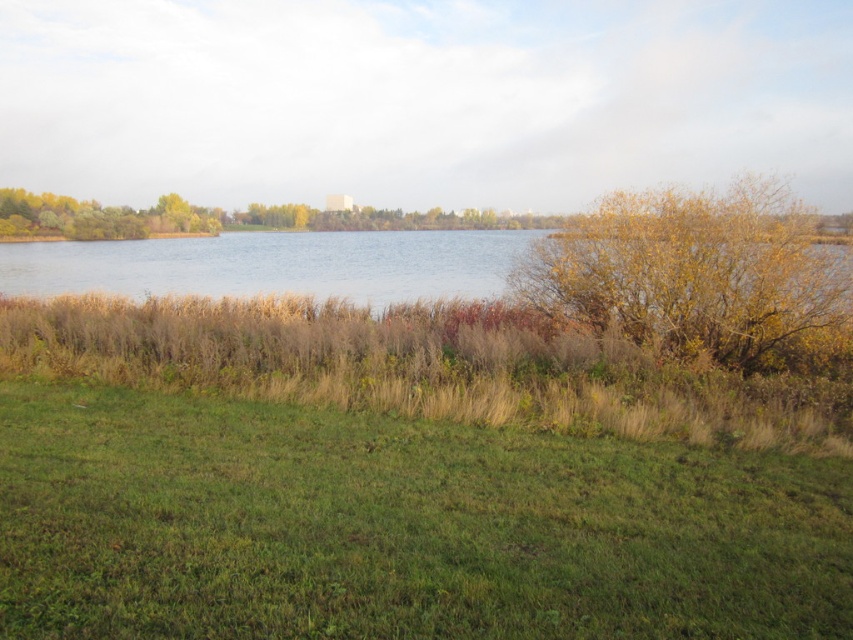
Question: Does yellow leafy bush at upper right appear on the right side of brown grassy lake at center?

Choices:
 (A) no
 (B) yes

Answer: (B)

Question: Where is brown grassy lake at center located in relation to yellow autumn leaves at center in the image?

Choices:
 (A) below
 (B) above

Answer: (A)

Question: Which object is farther from the camera taking this photo?

Choices:
 (A) green grassy at lower center
 (B) yellow leafy bush at upper right
 (C) yellow autumn leaves at center

Answer: (C)

Question: Based on their relative distances, which object is nearer to the green grassy at lower center?

Choices:
 (A) brown grassy lake at center
 (B) yellow leafy bush at upper right

Answer: (B)

Question: Is brown grassy lake at center above yellow autumn leaves at center?

Choices:
 (A) no
 (B) yes

Answer: (A)

Question: Which of the following is the closest to the observer?

Choices:
 (A) (167, 225)
 (B) (370, 614)

Answer: (B)